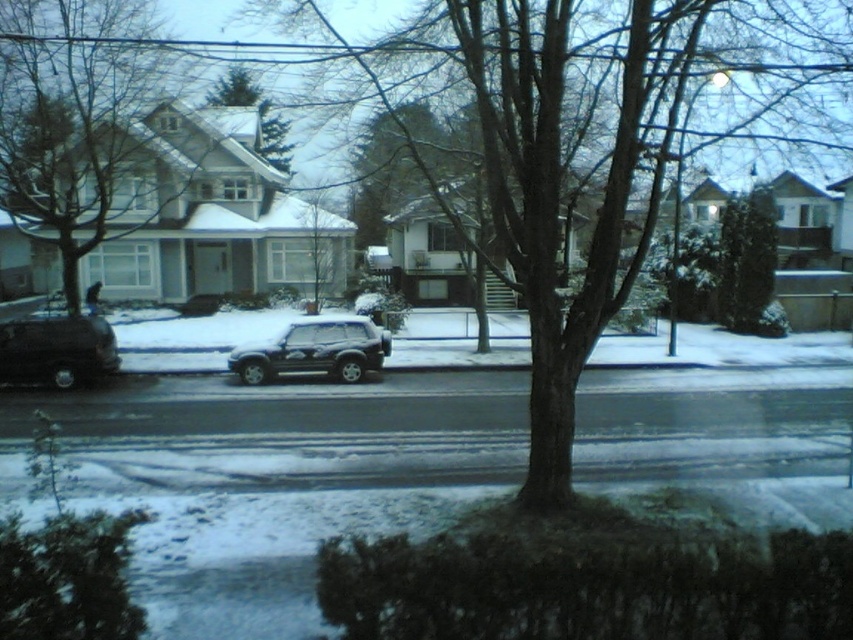
You are a gardener planning to prune the trees in the winter scene. Since both the brown textured tree at center and the green matte tree at center are in the same central area, which tree would you need to prune first if you start from the ground upwards?

The green matte tree at center would need to be pruned first because the brown textured tree at center is positioned over it, meaning the green one is lower and closer to the ground.

You are a delivery person trying to navigate through the snow. You see the smooth white tree at center and the shiny black suv at left. Which object is taller and could potentially block your view ahead?

The smooth white tree at center is taller than the shiny black suv at left, so it could potentially block your view ahead.

You are standing on the residential street and want to take a photo of the shiny black suv at left without the smooth white tree at center blocking the view. Is the suv currently visible from your position?

The smooth white tree at center is in front of the shiny black suv at left, so the suv may be partially or fully blocked by the tree depending on your angle. To ensure visibility, move to a position where the tree is not between you and the suv.